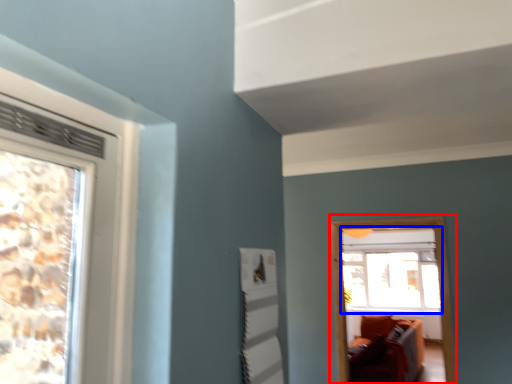
Question: Which object is closer to the camera taking this photo, window frame (highlighted by a red box) or window (highlighted by a blue box)?

Choices:
 (A) window frame
 (B) window

Answer: (A)